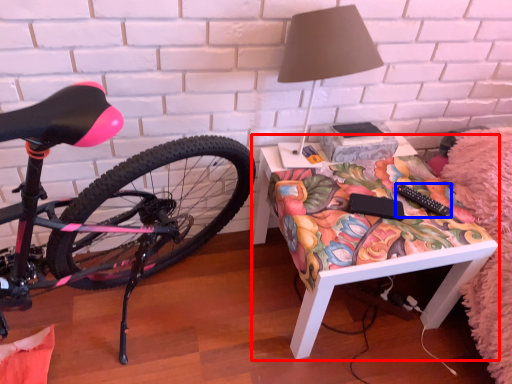
Question: Which of the following is the closest to the observer, desk (highlighted by a red box) or remote control (highlighted by a blue box)?

Choices:
 (A) desk
 (B) remote control

Answer: (A)